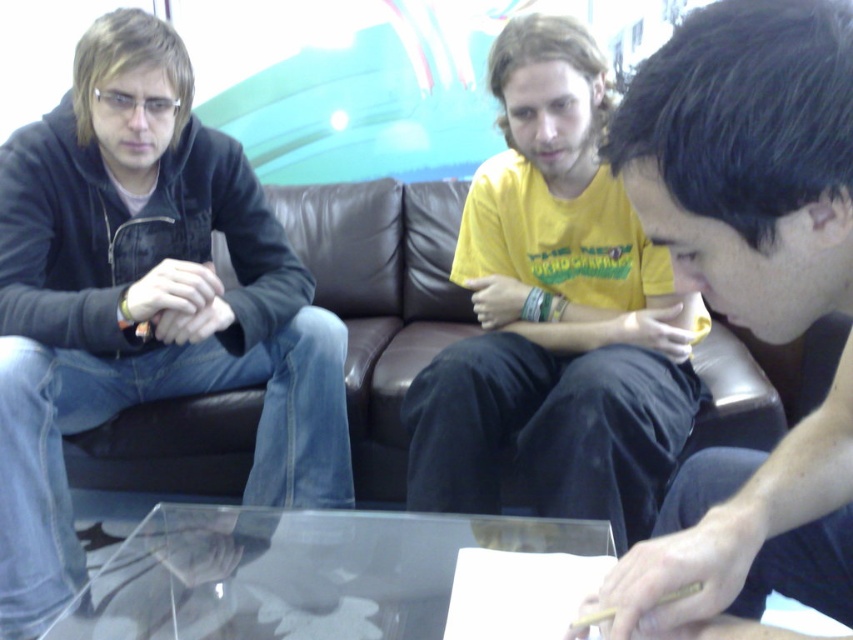
You are a photographer setting up a tripod to capture a headshot of the black matte shirt at center and the transparent glass table at center. Which object should you focus on first to ensure proper framing?

The black matte shirt at center is taller than the transparent glass table at center, so you should focus on the black matte shirt at center first to ensure proper framing.

You are a photographer standing in front of the scene. You want to take a closeup photo of the black matte shirt at center without including any other objects in the frame. What is the minimum distance you need to move forward to achieve this?

The black matte shirt at center is 19.45 inches away from the camera. To take a closeup photo of it without including other objects, you need to move forward until the camera is at least 19.45 inches away from the black matte shirt at center.